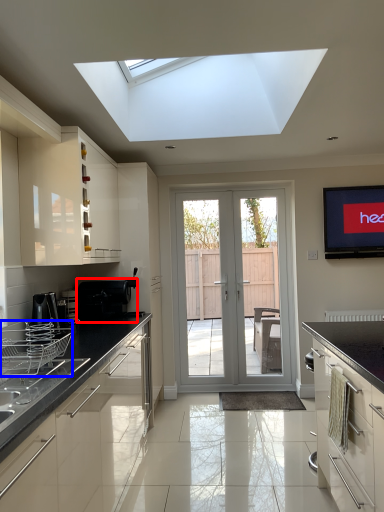
Question: Which object is closer to the camera taking this photo, appliance (highlighted by a red box) or appliance (highlighted by a blue box)?

Choices:
 (A) appliance
 (B) appliance

Answer: (B)